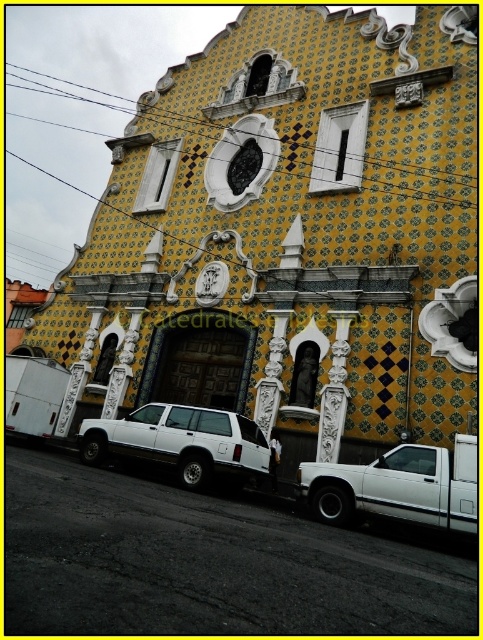
Question: Among these objects, which one is farthest from the camera?

Choices:
 (A) white matte suv at center
 (B) yellow mosaic tile church at center
 (C) white matte truck at lower right

Answer: (B)

Question: Estimate the real-world distances between objects in this image. Which object is farther from the white matte suv at center?

Choices:
 (A) white matte truck at lower right
 (B) yellow mosaic tile church at center

Answer: (B)

Question: Where is yellow mosaic tile church at center located in relation to white matte suv at center in the image?

Choices:
 (A) right
 (B) left

Answer: (B)

Question: Among these points, which one is nearest to the camera?

Choices:
 (A) (428, 362)
 (B) (426, 504)
 (C) (86, 460)

Answer: (B)

Question: Does yellow mosaic tile church at center have a lesser width compared to white matte truck at lower right?

Choices:
 (A) yes
 (B) no

Answer: (B)

Question: Observing the image, what is the correct spatial positioning of white matte truck at lower right in reference to white matte suv at center?

Choices:
 (A) right
 (B) left

Answer: (A)